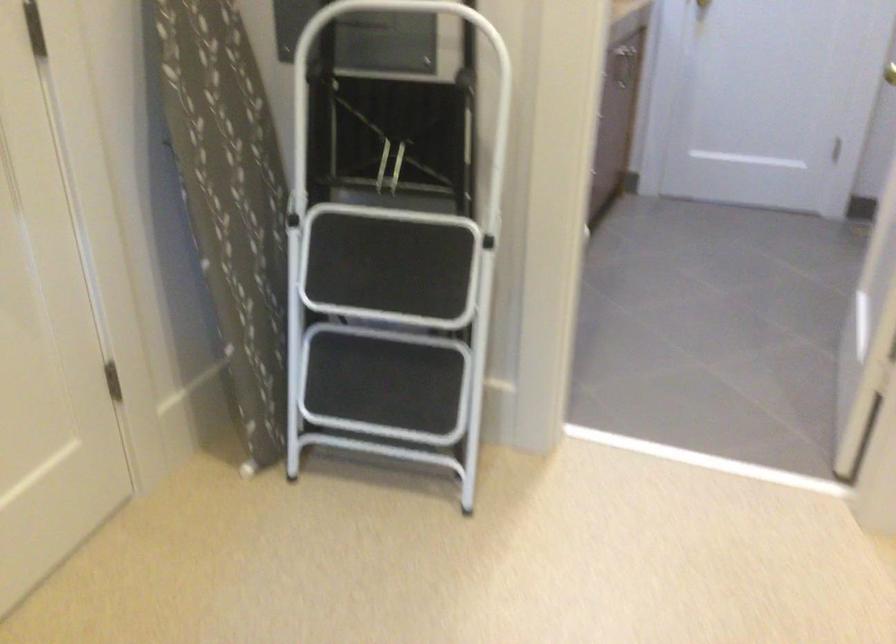
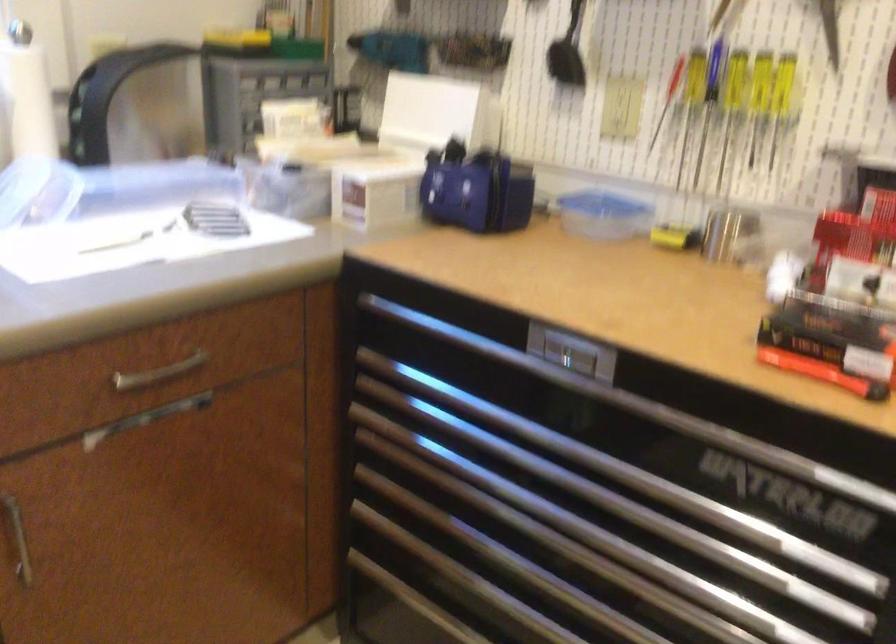
The first image is from the beginning of the video and the second image is from the end. How did the camera likely rotate when shooting the video?

The camera rotated toward left-down.